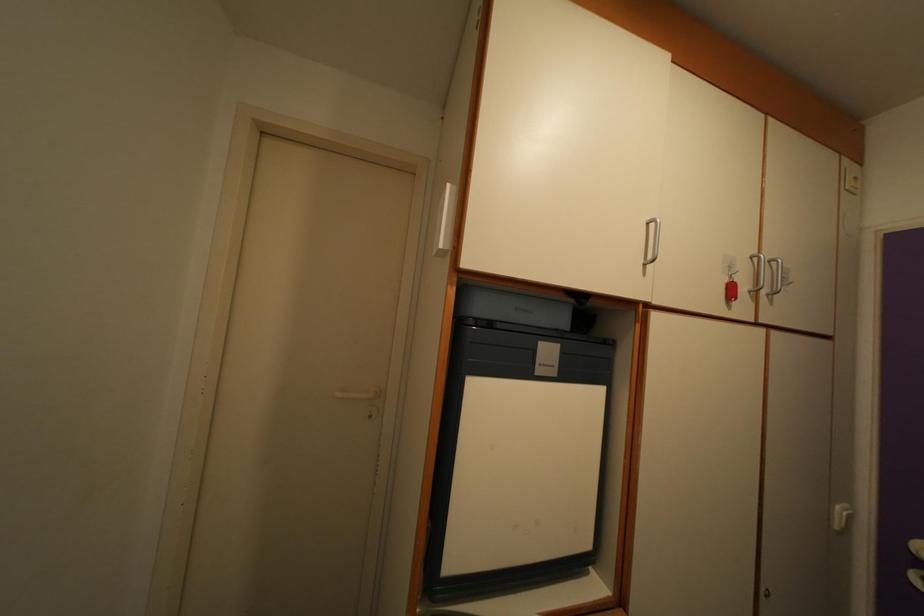
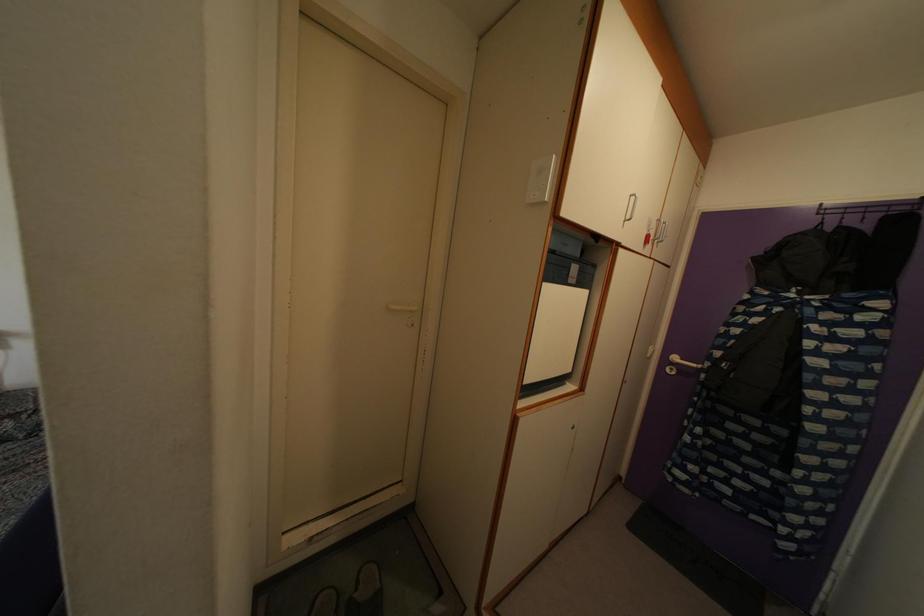
Question: The camera is either moving clockwise (left) or counter-clockwise (right) around the object. The first image is from the beginning of the video and the second image is from the end. Is the camera moving left or right when shooting the video?

Choices:
 (A) Left
 (B) Right

Answer: (A)